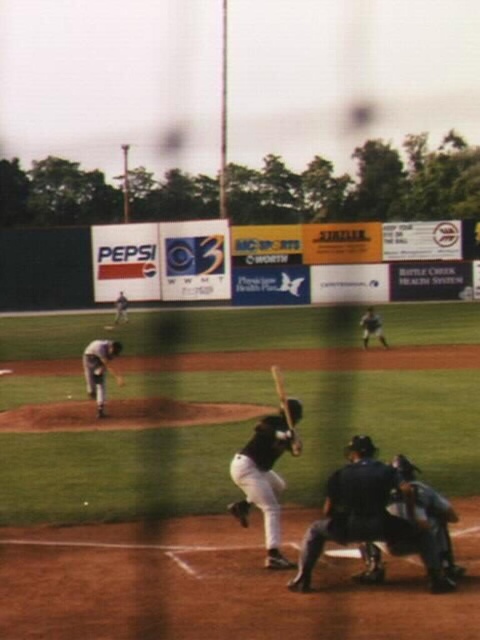
You are standing at the center field of the baseball field. You want to reach a point located at coordinates point (101,387) as quickly as possible. What is the shortest distance you need to cover?

The shortest distance you need to cover to reach point (101,387) is 44.26 feet.

You are a photographer trying to capture a closeup of the wooden baseball bat at center and the dark brown leather glove at lower center. Which object should you focus on first if you want to ensure both are in focus, considering their sizes?

The wooden baseball bat at center has a greater height compared to the dark brown leather glove at lower center, so you should focus on the wooden baseball bat at center first to ensure both are in focus.